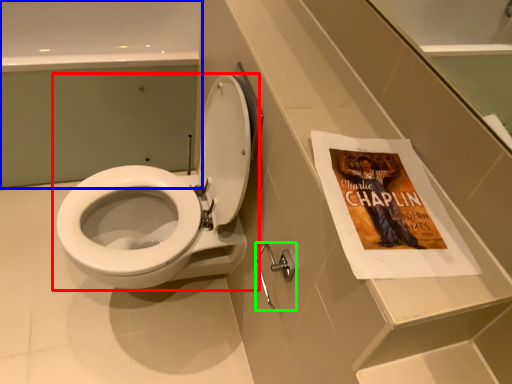
Question: Which object is the closest to the toilet (highlighted by a red box)? Choose among these: bath (highlighted by a blue box) or towel bar (highlighted by a green box).

Choices:
 (A) bath
 (B) towel bar

Answer: (B)